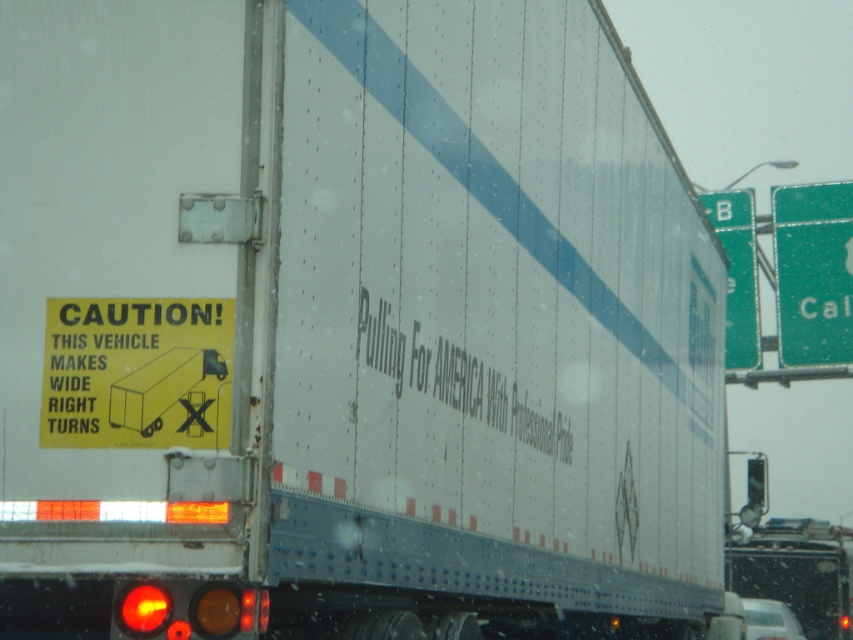
Who is lower down, green metallic sign at upper right or green glossy sign at upper right?

green glossy sign at upper right is below.

Which is behind, point (830, 278) or point (718, 227)?

Positioned behind is point (718, 227).

At what (x,y) coordinates should I click in order to perform the action: click on green metallic sign at upper right. Please return your answer as a coordinate pair (x, y). Image resolution: width=853 pixels, height=640 pixels. Looking at the image, I should click on (813, 273).